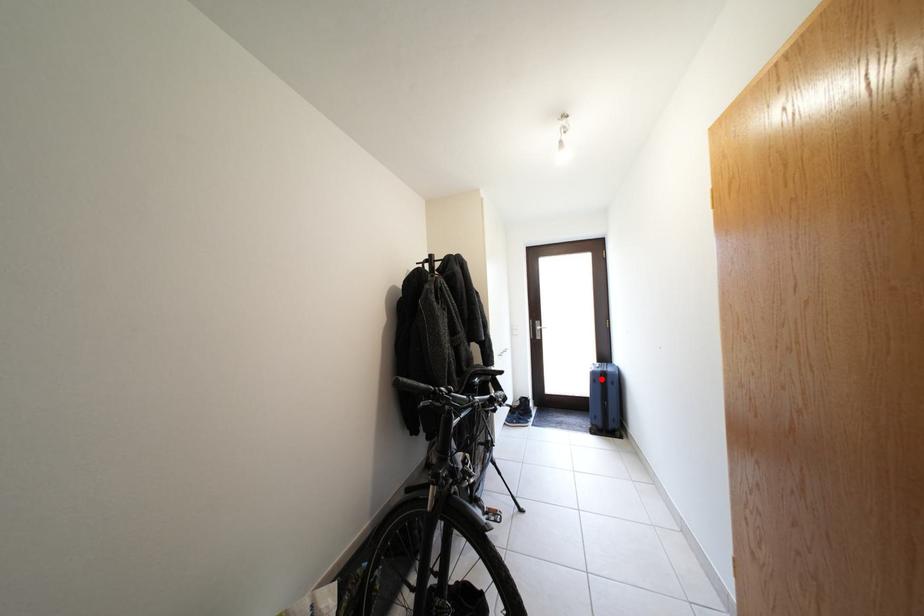
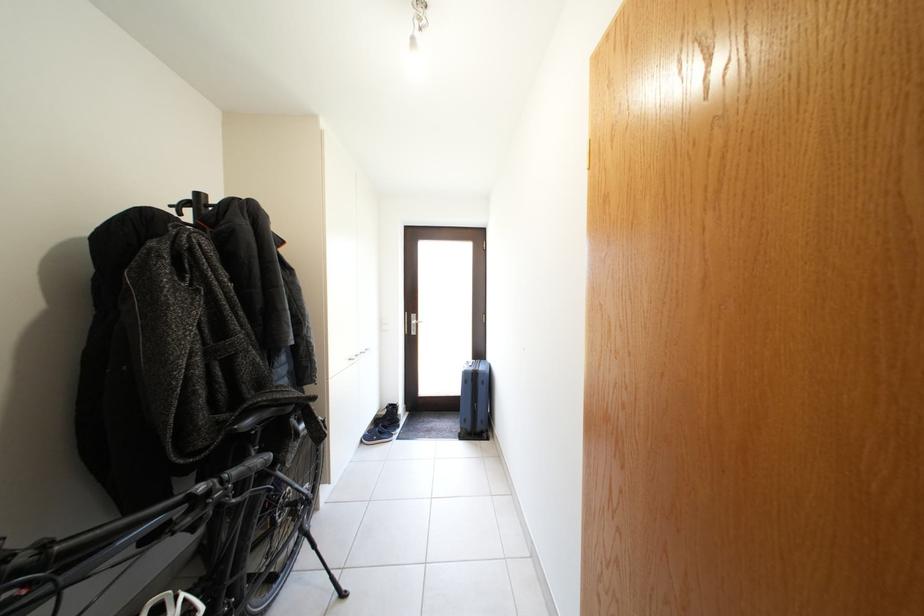
Question: I am providing you with two images of the same scene from different viewpoints. Image1 has a red point marked. In image2, the corresponding 3D location appears at what relative position? Reply with the corresponding letter.

Choices:
 (A) Closer
 (B) Farther

Answer: (B)